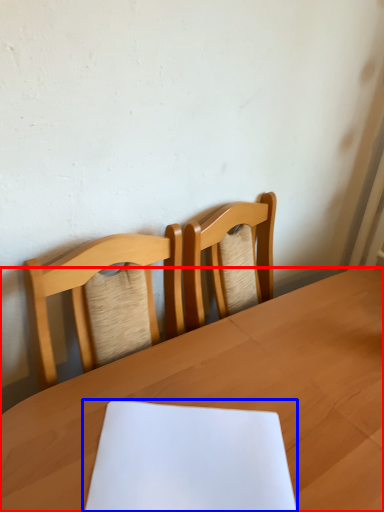
Question: Which of the following is the farthest to the observer, table (highlighted by a red box) or notebook (highlighted by a blue box)?

Choices:
 (A) table
 (B) notebook

Answer: (B)